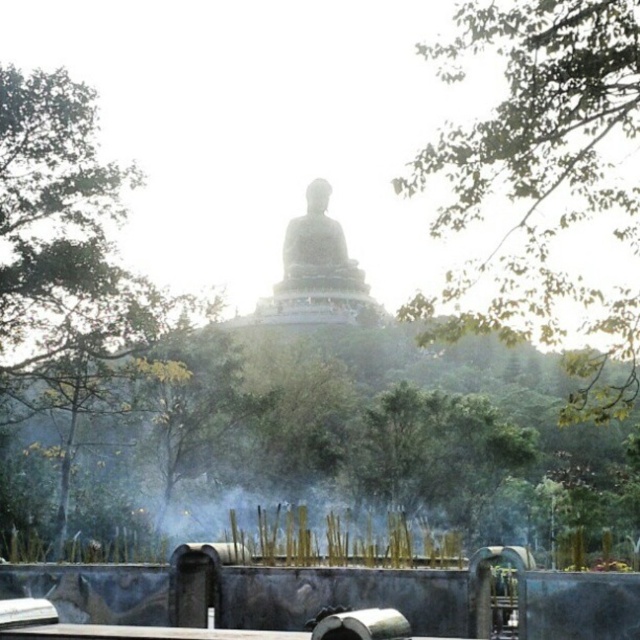
Is green leafy tree at upper right to the right of green leafy tree at left from the viewer's perspective?

Yes, green leafy tree at upper right is to the right of green leafy tree at left.

Between green leafy tree at upper right and green leafy tree at left, which one is positioned lower?

green leafy tree at left is lower down.

What do you see at coordinates (541, 177) in the screenshot?
I see `green leafy tree at upper right` at bounding box center [541, 177].

Where is `green leafy tree at upper right`? Image resolution: width=640 pixels, height=640 pixels. green leafy tree at upper right is located at coordinates (541, 177).

Which is behind, point (545, 16) or point (308, 209)?

Positioned behind is point (308, 209).

Between green leafy tree at upper right and white marble statue at center, which one appears on the right side from the viewer's perspective?

green leafy tree at upper right is more to the right.

Image resolution: width=640 pixels, height=640 pixels. Identify the location of green leafy tree at upper right. (541, 177).

You are a GUI agent. You are given a task and a screenshot of the screen. Output one action in this format:
    pyautogui.click(x=<x>, y=<y>)
    Task: Click on the green leafy tree at upper right
    Image resolution: width=640 pixels, height=640 pixels.
    Given the screenshot: What is the action you would take?
    coord(541,177)

Is green leafy tree at left thinner than white marble statue at center?

No, green leafy tree at left is not thinner than white marble statue at center.

Is green leafy tree at left behind white marble statue at center?

No, green leafy tree at left is in front of white marble statue at center.

Describe the element at coordinates (67, 257) in the screenshot. I see `green leafy tree at left` at that location.

Where is `green leafy tree at left`? This screenshot has width=640, height=640. green leafy tree at left is located at coordinates (67, 257).